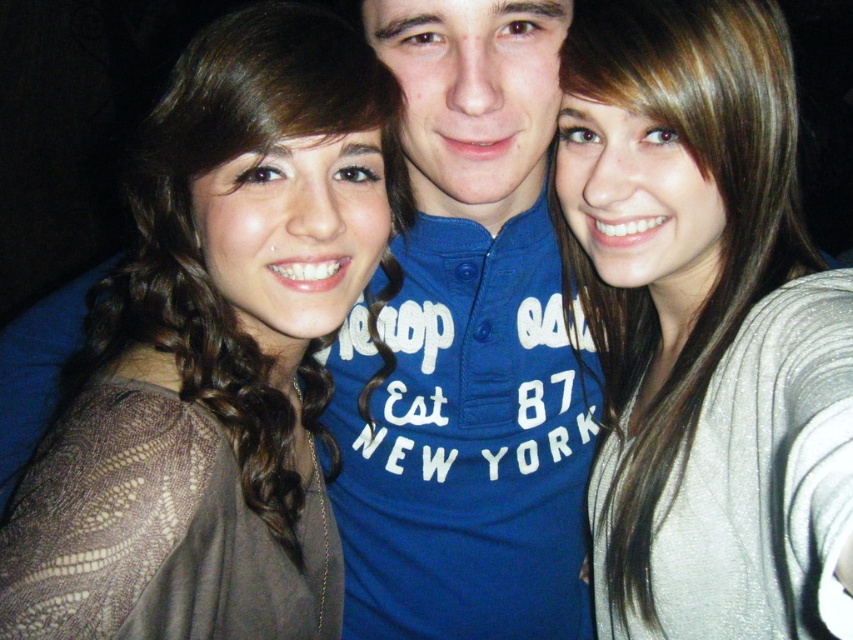
You are trying to take a photo of the blue cotton shirt at center and the brown lace top at left. Which one should you focus on if you want to capture the taller object in the frame?

The blue cotton shirt at center is much taller than the brown lace top at left, so you should focus on the blue cotton shirt at center to capture the taller object in the frame.

You are a photographer standing at a distance of 50 centimeters from the camera. You want to take a closeup shot of the satin silver sweater at center. Is your current position sufficient to capture the sweater in focus without moving closer?

The distance between the satin silver sweater at center and the camera is 50.56 centimeters. Since you are standing at 50 centimeters, you need to move slightly closer by 0.56 centimeters to ensure the sweater is in focus.